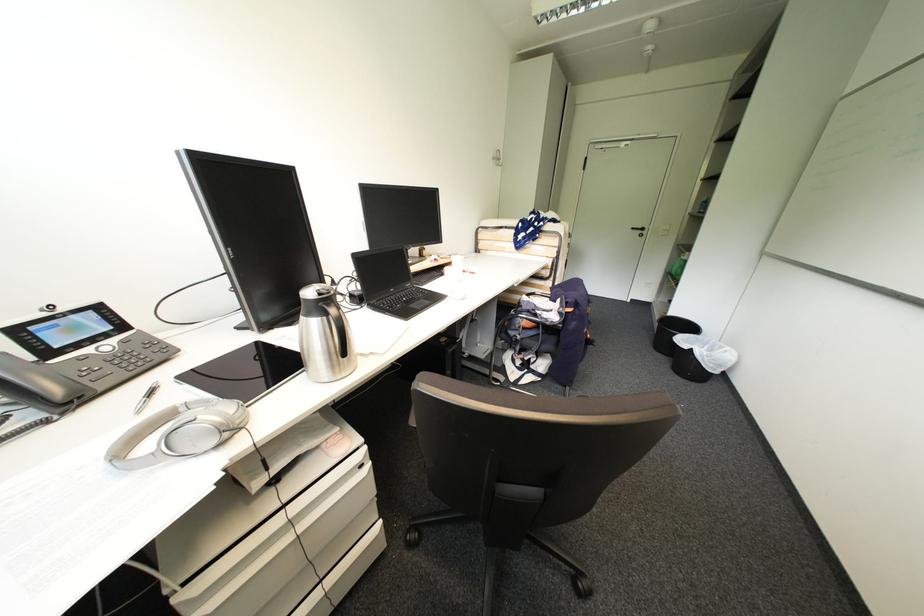
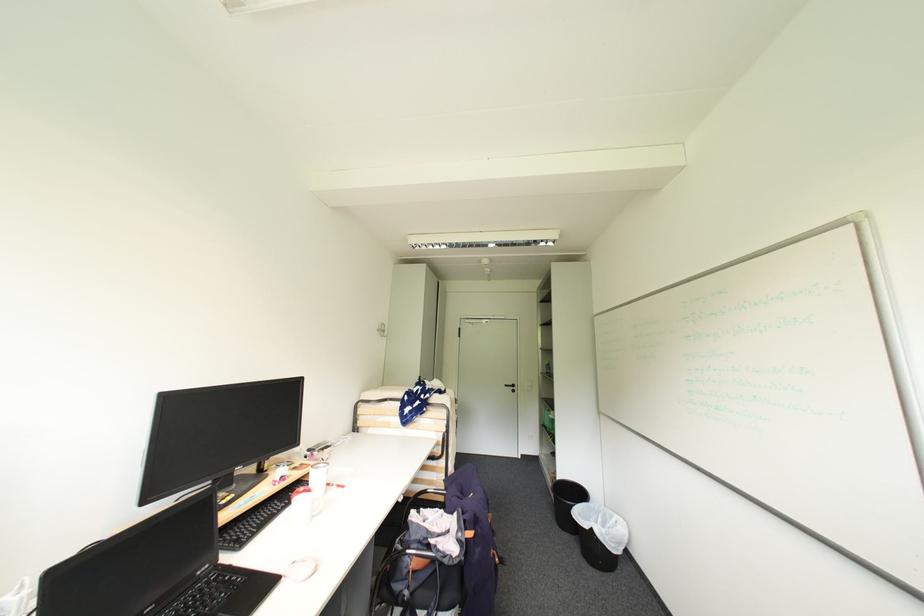
Locate, in the second image, the point that corresponds to the point at 699,336 in the first image.

(591, 505)